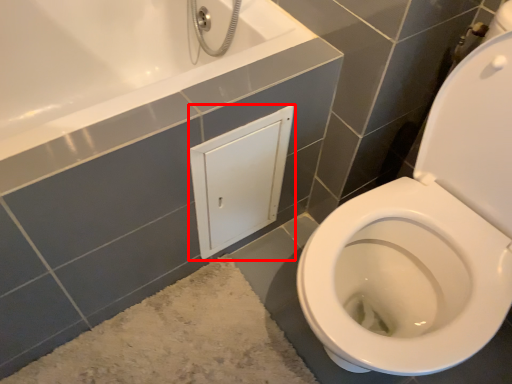
Question: From the image's perspective, where is medicine cabinet (annotated by the red box) located relative to bath mat?

Choices:
 (A) below
 (B) above

Answer: (B)